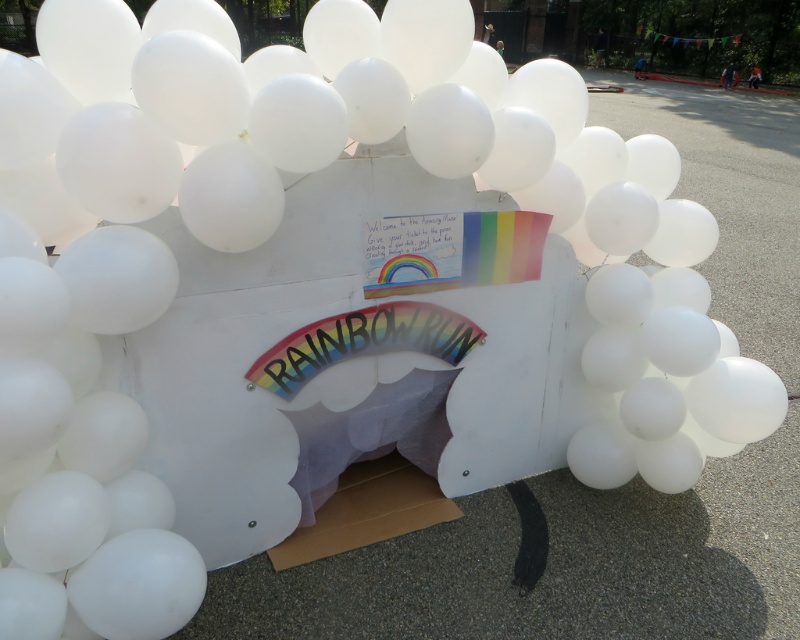
Question: Is white cardboard box at center further to the viewer compared to cardboard at center?

Choices:
 (A) no
 (B) yes

Answer: (A)

Question: Among these points, which one is nearest to the camera?

Choices:
 (A) (352, 422)
 (B) (368, 476)

Answer: (A)

Question: Which of the following is the farthest from the observer?

Choices:
 (A) (312, 545)
 (B) (168, 369)

Answer: (A)

Question: Which object appears closest to the camera in this image?

Choices:
 (A) white cardboard box at center
 (B) cardboard at center

Answer: (A)

Question: Is white cardboard box at center below cardboard at center?

Choices:
 (A) no
 (B) yes

Answer: (A)

Question: Can you confirm if white cardboard box at center is positioned above cardboard at center?

Choices:
 (A) no
 (B) yes

Answer: (B)